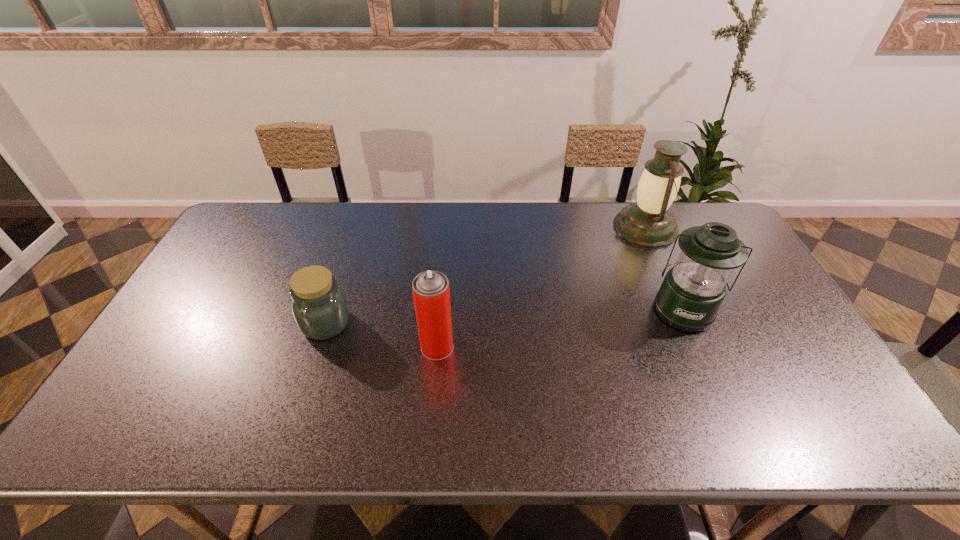
Identify the location of free space located on the back of the shortest object. The image size is (960, 540). (349, 251).

What are the coordinates of `object that is at the far edge` in the screenshot? It's located at coord(648,223).

At what (x,y) coordinates should I click in order to perform the action: click on vacant space at the far edge. Please return your answer as a coordinate pair (x, y). Looking at the image, I should click on (283, 225).

You are a GUI agent. You are given a task and a screenshot of the screen. Output one action in this format:
    pyautogui.click(x=<x>, y=<y>)
    Task: Click on the free spot at the near edge of the desktop
    The height and width of the screenshot is (540, 960).
    Given the screenshot: What is the action you would take?
    pyautogui.click(x=195, y=437)

The image size is (960, 540). Find the location of `vacant region at the left edge of the desktop`. vacant region at the left edge of the desktop is located at coordinates (150, 393).

This screenshot has width=960, height=540. In the image, there is a desktop. What are the coordinates of `vacant space at the right edge` in the screenshot? It's located at (778, 320).

In the image, there is a desktop. Where is `free space at the far left corner`? Image resolution: width=960 pixels, height=540 pixels. free space at the far left corner is located at coordinates (255, 214).

The width and height of the screenshot is (960, 540). What are the coordinates of `vacant space at the near right corner of the desktop` in the screenshot? It's located at pos(845,441).

Image resolution: width=960 pixels, height=540 pixels. In order to click on vacant region between the second object from left to right and the farthest object in this screenshot , I will do `click(541, 287)`.

Where is `unoccupied area between the shortest object and the farthest object`? unoccupied area between the shortest object and the farthest object is located at coordinates (486, 275).